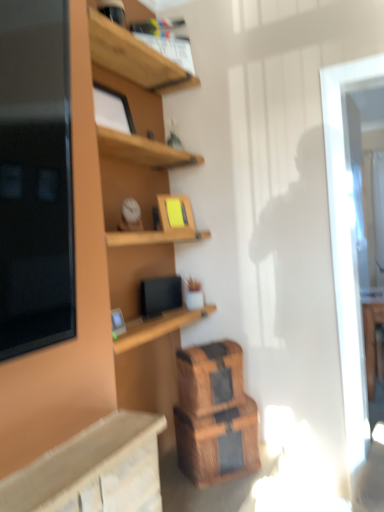
Question: Is wooden crate at lower center, the 1th crate positioned from the top, at the right side of wooden crate at lower center, positioned as the 1th crate in bottom-to-top order?

Choices:
 (A) no
 (B) yes

Answer: (A)

Question: From the image's perspective, is wooden crate at lower center, the 1th crate positioned from the top, located beneath wooden crate at lower center, acting as the 2th crate starting from the top?

Choices:
 (A) no
 (B) yes

Answer: (A)

Question: Can you confirm if wooden crate at lower center, the second crate from the bottom, is thinner than wooden crate at lower center, positioned as the 1th crate in bottom-to-top order?

Choices:
 (A) yes
 (B) no

Answer: (A)

Question: Is wooden crate at lower center, positioned as the 1th crate in bottom-to-top order, located within wooden crate at lower center, the second crate from the bottom?

Choices:
 (A) no
 (B) yes

Answer: (A)

Question: Is wooden crate at lower center, the 1th crate positioned from the top, turned away from wooden crate at lower center, positioned as the 1th crate in bottom-to-top order?

Choices:
 (A) yes
 (B) no

Answer: (B)

Question: From their relative heights in the image, would you say wooden crate at lower center, the 1th crate positioned from the top, is taller or shorter than transparent glass door at right?

Choices:
 (A) short
 (B) tall

Answer: (A)

Question: Based on their sizes in the image, would you say wooden crate at lower center, the second crate from the bottom, is bigger or smaller than transparent glass door at right?

Choices:
 (A) small
 (B) big

Answer: (A)

Question: From the image's perspective, relative to transparent glass door at right, is wooden crate at lower center, the 1th crate positioned from the top, above or below?

Choices:
 (A) below
 (B) above

Answer: (A)

Question: From a real-world perspective, relative to transparent glass door at right, is wooden crate at lower center, the second crate from the bottom, vertically above or below?

Choices:
 (A) below
 (B) above

Answer: (A)

Question: Is wooden crate at lower center, acting as the 2th crate starting from the top, wider or thinner than wooden shelf at upper center?

Choices:
 (A) wide
 (B) thin

Answer: (A)

Question: In the image, is wooden crate at lower center, positioned as the 1th crate in bottom-to-top order, on the left side or the right side of wooden shelf at upper center?

Choices:
 (A) right
 (B) left

Answer: (A)

Question: From a real-world perspective, relative to wooden shelf at upper center, is wooden crate at lower center, positioned as the 1th crate in bottom-to-top order, vertically above or below?

Choices:
 (A) above
 (B) below

Answer: (B)

Question: Choose the correct answer: Is wooden crate at lower center, acting as the 2th crate starting from the top, inside wooden shelf at upper center or outside it?

Choices:
 (A) inside
 (B) outside

Answer: (B)

Question: From the image's perspective, is wooden shelf at upper center located above or below wooden crate at lower center, positioned as the 1th crate in bottom-to-top order?

Choices:
 (A) below
 (B) above

Answer: (B)

Question: Considering the positions of wooden shelf at upper center and wooden crate at lower center, positioned as the 1th crate in bottom-to-top order, in the image, is wooden shelf at upper center taller or shorter than wooden crate at lower center, positioned as the 1th crate in bottom-to-top order,?

Choices:
 (A) short
 (B) tall

Answer: (B)